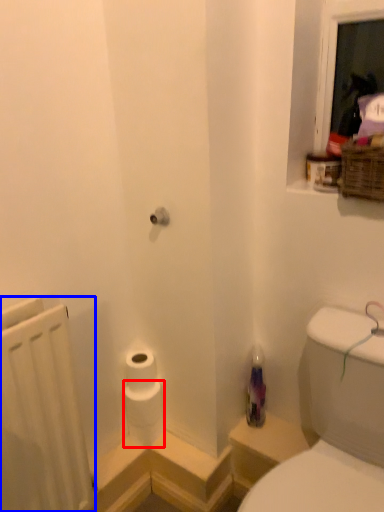
Question: Which object appears closest to the camera in this image, toilet paper (highlighted by a red box) or radiator (highlighted by a blue box)?

Choices:
 (A) toilet paper
 (B) radiator

Answer: (B)